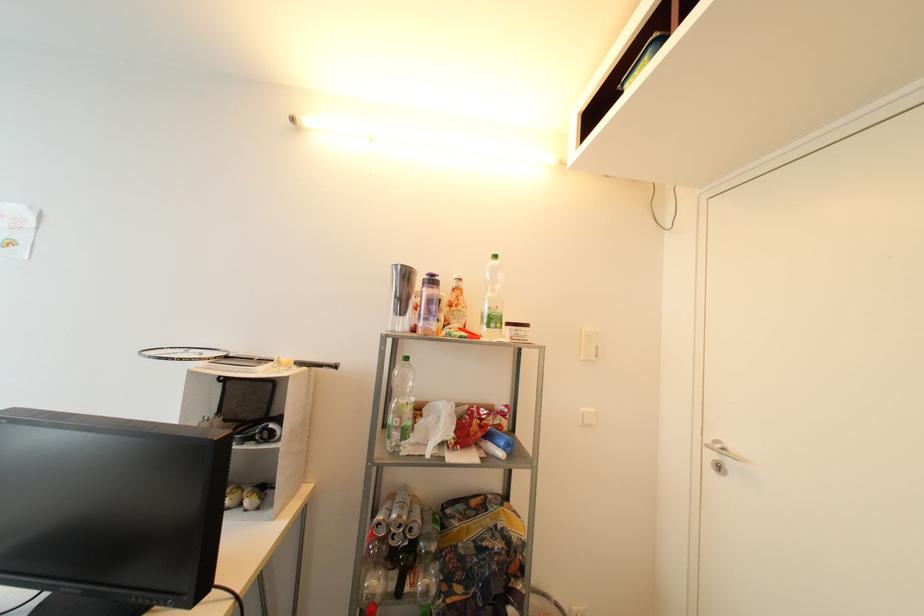
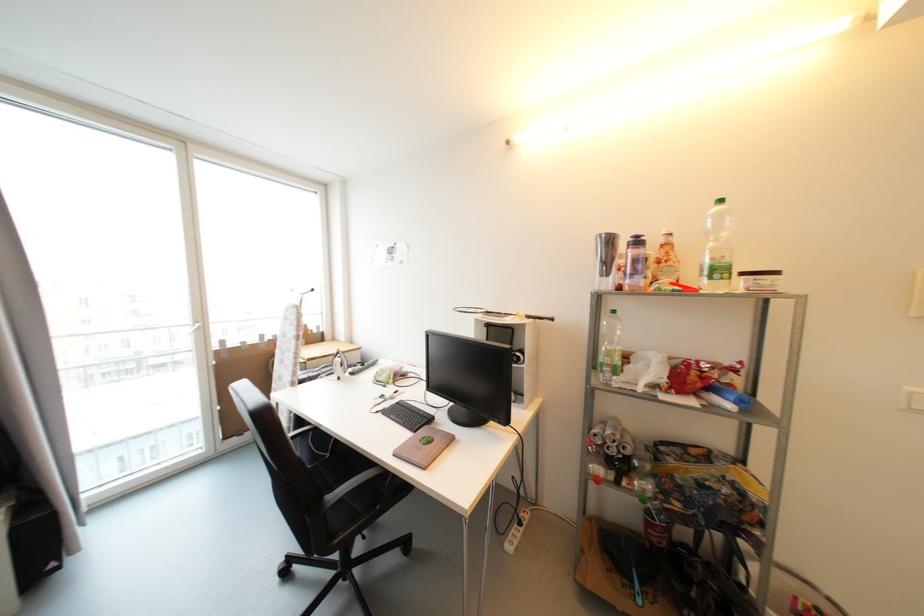
Question: The camera is either moving clockwise (left) or counter-clockwise (right) around the object. The first image is from the beginning of the video and the second image is from the end. Is the camera moving left or right when shooting the video?

Choices:
 (A) Left
 (B) Right

Answer: (B)